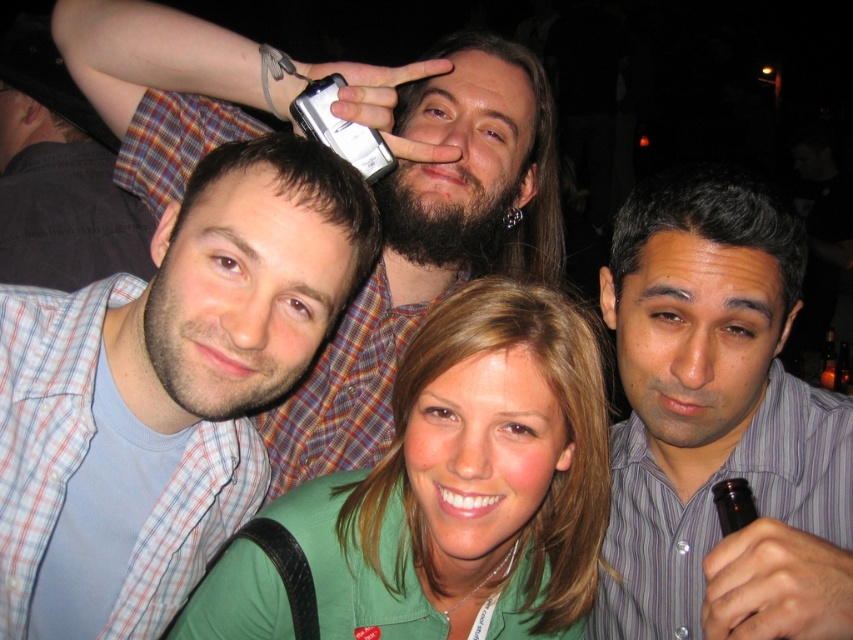
Measure the distance from striped button-up shirt at right to light blue shirt at left.

18.43 inches

Is striped button-up shirt at right below light blue shirt at left?

Yes.

Locate an element on the screen. striped button-up shirt at right is located at coordinates (718, 422).

Identify the location of striped button-up shirt at right. [x=718, y=422].

Does light blue shirt at left appear over plaid shirt at upper left?

No.

Does light blue shirt at left have a lesser height compared to plaid shirt at upper left?

Yes.

Identify the location of light blue shirt at left. (428, 237).

Which is more to the left, matte blue shirt at center or green fabric shirt at center?

matte blue shirt at center

Who is more distant from viewer, (308, 253) or (596, 428)?

Positioned behind is point (596, 428).

Is point (86, 353) less distant than point (479, 360)?

No, (86, 353) is further to viewer.

In order to click on matte blue shirt at center in this screenshot , I will do pyautogui.click(x=165, y=388).